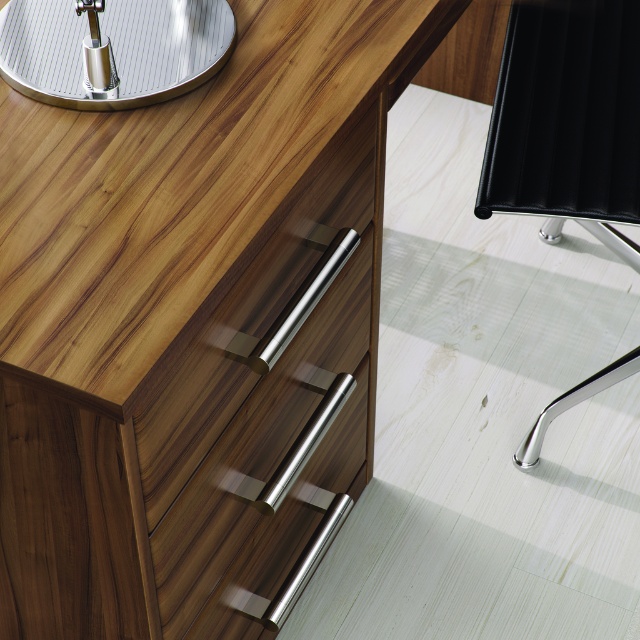
You are standing at the center of the desk and want to sit down. Which object at point (566, 120) is available for you to sit on?

The point (566, 120) corresponds to the black leather swivel chair at right, which is available for sitting.

You are standing at the origin of the coordinate system in the office desk scene. You see two points labeled as point 1 and point 2. If point 1 is at coordinate point [384,60] and point 2 is at coordinate point [20,49], which point is further away from you along the Z axis?

Point 1 at coordinate point [384,60] is further away from you along the Z axis than point 2 at coordinate point [20,49].

You are an office worker who needs to move a 40 cm wide box from the polished silver table at upper left to the black leather swivel chair at right. Can the chair accommodate the box in terms of width?

The black leather swivel chair at right is wider than the polished silver table at upper left. Since the box is 40 cm wide, it should fit on the chair as long as the chair has a flat surface large enough to hold it. However, the description does not specify the chair seat dimensions, so this is an assumption based on width comparison.